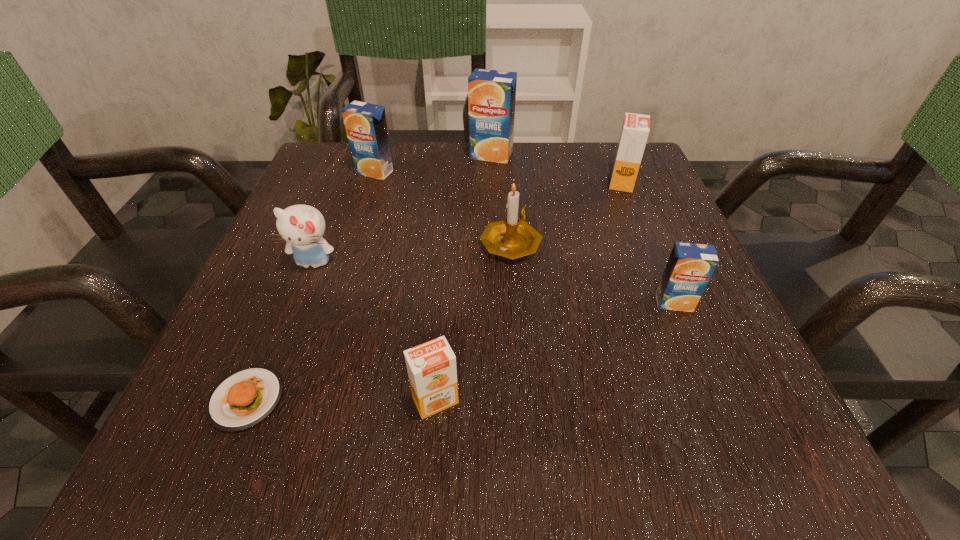
This screenshot has height=540, width=960. Identify the location of the tallest object. (491, 93).

Find the location of a particular element. This screenshot has width=960, height=540. the biggest blue orange_juice is located at coordinates (491, 93).

Find the location of a particular element. the second smallest blue orange_juice is located at coordinates (366, 127).

Where is `the leftmost orange juice`? the leftmost orange juice is located at coordinates (366, 127).

In order to click on the farther orange orange juice in this screenshot , I will do `click(635, 129)`.

This screenshot has height=540, width=960. Find the location of `the right orange orange juice`. the right orange orange juice is located at coordinates (635, 129).

The height and width of the screenshot is (540, 960). What are the coordinates of `gold candle holder` in the screenshot? It's located at (513, 238).

Locate an element on the screen. kitten is located at coordinates (302, 226).

This screenshot has height=540, width=960. I want to click on the nearest blue orange_juice, so click(x=690, y=266).

In order to click on the smallest blue orange_juice in this screenshot , I will do `click(690, 266)`.